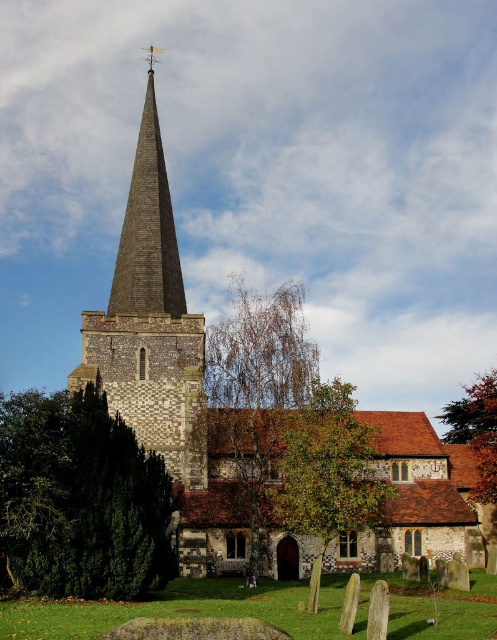
You are standing 100 meters away from the historic church. There is a point at coordinates point (174, 301) on the church. Can you reach that point by walking forward 6 meters?

The distance of point (174, 301) from viewer is 94.02 meters. Since you are currently 100 meters away, walking forward 6 meters would bring you to 94 meters away, which matches the point. Therefore, yes, you can reach it by walking forward 6 meters.

What is the spatial relationship between the brown brick steeple at upper left and the brown textured tree at upper right in the image?

The brown brick steeple at upper left is taller than the brown textured tree at upper right.